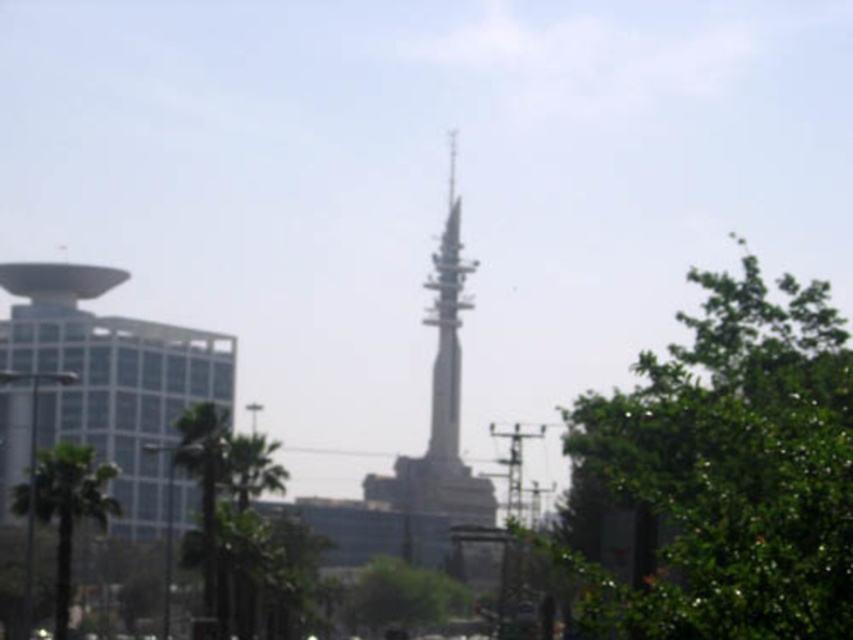
Can you confirm if green leafy tree at right is positioned to the left of white glass building at left?

In fact, green leafy tree at right is to the right of white glass building at left.

Between green leafy tree at right and white glass building at left, which one has less height?

green leafy tree at right is shorter.

Is point (688, 598) closer to viewer compared to point (42, 278)?

That is True.

Locate an element on the screen. This screenshot has width=853, height=640. green leafy tree at right is located at coordinates (726, 472).

Is point (128, 522) in front of point (447, 595)?

Yes, point (128, 522) is in front of point (447, 595).

The image size is (853, 640). Find the location of `white glass building at left`. white glass building at left is located at coordinates (111, 376).

Who is lower down, metallic spire at center or green leafy tree at center?

Positioned lower is green leafy tree at center.

In the scene shown: Is metallic spire at center smaller than green leafy tree at center?

No, metallic spire at center is not smaller than green leafy tree at center.

Measure the distance between metallic spire at center and camera.

metallic spire at center and camera are 78.04 meters apart.

The height and width of the screenshot is (640, 853). What are the coordinates of `metallic spire at center` in the screenshot? It's located at (440, 400).